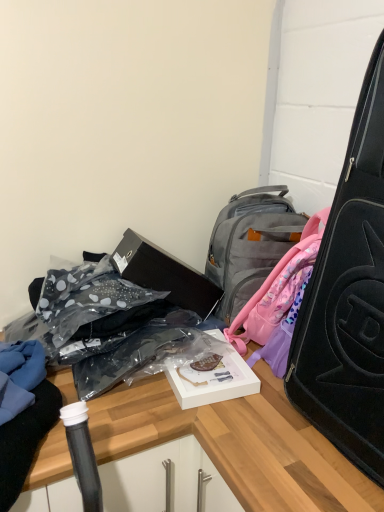
The height and width of the screenshot is (512, 384). I want to click on clear plastic bag at lower left, so 139,354.

Measure the distance between black matte box at center and camera.

black matte box at center is 1.19 meters from camera.

The width and height of the screenshot is (384, 512). I want to click on black matte box at center, so click(165, 274).

This screenshot has width=384, height=512. What are the coordinates of `white matte box at center` in the screenshot? It's located at (213, 379).

What do you see at coordinates (213, 379) in the screenshot? I see `white matte box at center` at bounding box center [213, 379].

I want to click on clear plastic bag at lower left, so click(x=139, y=354).

How different are the orientations of white matte box at center and black matte suitcase at right in degrees?

white matte box at center and black matte suitcase at right are facing 78 degrees away from each other.

The height and width of the screenshot is (512, 384). In order to click on suitcase above the white matte box at center (from the image's perspective) in this screenshot , I will do `click(348, 298)`.

Who is bigger, white matte box at center or black matte suitcase at right?

With larger size is black matte suitcase at right.

Which object is positioned more to the left, black matte box at center or black matte suitcase at right?

black matte box at center is more to the left.

Which of these two, black matte box at center or black matte suitcase at right, is smaller?

black matte box at center.

Would you say black matte box at center is a long distance from black matte suitcase at right?

No, black matte box at center is not far from black matte suitcase at right.

From the image's perspective, is black matte box at center located above or below black matte suitcase at right?

From the image's perspective, black matte box at center appears below black matte suitcase at right.

How distant is black matte suitcase at right from gray fabric backpack at upper center?

A distance of 7.78 inches exists between black matte suitcase at right and gray fabric backpack at upper center.

Which of these two, black matte suitcase at right or gray fabric backpack at upper center, is wider?

black matte suitcase at right.

Consider the image. In terms of height, does black matte suitcase at right look taller or shorter compared to gray fabric backpack at upper center?

black matte suitcase at right is taller than gray fabric backpack at upper center.

Is gray fabric backpack at upper center located within black matte suitcase at right?

No, gray fabric backpack at upper center is not a part of black matte suitcase at right.

Between white matte box at center and gray fabric backpack at upper center, which one is positioned in front?

white matte box at center is more forward.

Consider the image. Does white matte box at center have a lesser height compared to gray fabric backpack at upper center?

Yes.

Would you say white matte box at center contains gray fabric backpack at upper center?

That's incorrect, gray fabric backpack at upper center is not inside white matte box at center.

Which is more to the right, clear plastic bag at lower left or white matte box at center?

Positioned to the right is white matte box at center.

Is clear plastic bag at lower left behind white matte box at center?

No.

Considering the points (28, 331) and (206, 379), which point is in front, point (28, 331) or point (206, 379)?

The point (206, 379) is in front.

This screenshot has height=512, width=384. I want to click on bag that appears above the white matte box at center (from a real-world perspective), so click(x=139, y=354).

Which of these two, white matte box at center or clear plastic bag at lower left, stands taller?

clear plastic bag at lower left is taller.

From a real-world perspective, is white matte box at center physically located above or below clear plastic bag at lower left?

Clearly, from a real-world perspective, white matte box at center is below clear plastic bag at lower left.

Based on the photo, is white matte box at center to the left or to the right of clear plastic bag at lower left in the image?

From the image, it's evident that white matte box at center is to the right of clear plastic bag at lower left.

You are a GUI agent. You are given a task and a screenshot of the screen. Output one action in this format:
    pyautogui.click(x=<x>, y=<y>)
    Task: Click on the kit behind the clear plastic bag at lower left
    This screenshot has width=384, height=512.
    Given the screenshot: What is the action you would take?
    pyautogui.click(x=213, y=379)

Does black matte box at center lie in front of gray fabric backpack at upper center?

Yes, black matte box at center is in front of gray fabric backpack at upper center.

Is black matte box at center to the right of gray fabric backpack at upper center from the viewer's perspective?

No, black matte box at center is not to the right of gray fabric backpack at upper center.

Find the location of `backpack behind the black matte box at center`. backpack behind the black matte box at center is located at coordinates (278, 289).

The image size is (384, 512). I want to click on kit that appears below the black matte suitcase at right (from the image's perspective), so click(213, 379).

Locate an element on the screen. The image size is (384, 512). box on the left of black matte suitcase at right is located at coordinates (165, 274).

Estimate the real-world distances between objects in this image. Which object is further from black matte box at center, gray fabric backpack at upper center or clear plastic bag at lower left?

The object further to black matte box at center is gray fabric backpack at upper center.

Based on their spatial positions, is black matte suitcase at right or black matte box at center further from gray fabric backpack at upper center?

black matte box at center lies further to gray fabric backpack at upper center than the other object.

Looking at the image, which one is located further to clear plastic bag at lower left, gray fabric backpack at upper center or black matte suitcase at right?

black matte suitcase at right is positioned further to the anchor clear plastic bag at lower left.

Considering their positions, is black matte suitcase at right positioned further to white matte box at center than gray fabric backpack at upper center?

black matte suitcase at right.

Based on their spatial positions, is gray fabric backpack at upper center or black matte box at center further from white matte box at center?

black matte box at center is further to white matte box at center.

From the image, which object appears to be nearer to gray fabric backpack at upper center, black matte box at center or white matte box at center?

Among the two, white matte box at center is located nearer to gray fabric backpack at upper center.

From the image, which object appears to be farther from gray fabric backpack at upper center, black matte box at center or black matte suitcase at right?

The object further to gray fabric backpack at upper center is black matte box at center.

Based on their spatial positions, is white matte box at center or black matte box at center closer to black matte suitcase at right?

Based on the image, white matte box at center appears to be nearer to black matte suitcase at right.

Locate an element on the screen. The image size is (384, 512). box situated between clear plastic bag at lower left and gray fabric backpack at upper center from left to right is located at coordinates (165, 274).

The height and width of the screenshot is (512, 384). Identify the location of bag that lies between black matte box at center and white matte box at center from top to bottom. (139, 354).

The width and height of the screenshot is (384, 512). Find the location of `box between clear plastic bag at lower left and black matte suitcase at right in the horizontal direction`. box between clear plastic bag at lower left and black matte suitcase at right in the horizontal direction is located at coordinates (165, 274).

At what (x,y) coordinates should I click in order to perform the action: click on kit between clear plastic bag at lower left and gray fabric backpack at upper center. Please return your answer as a coordinate pair (x, y). Looking at the image, I should click on (213, 379).